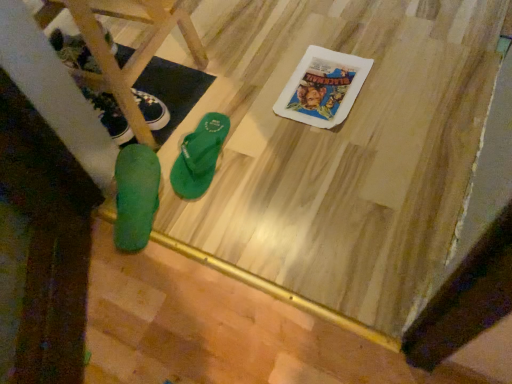
Locate an element on the screen. empty space that is to the right of green rubber flip-flop at center, the third footwear positioned from the left is located at coordinates (263, 144).